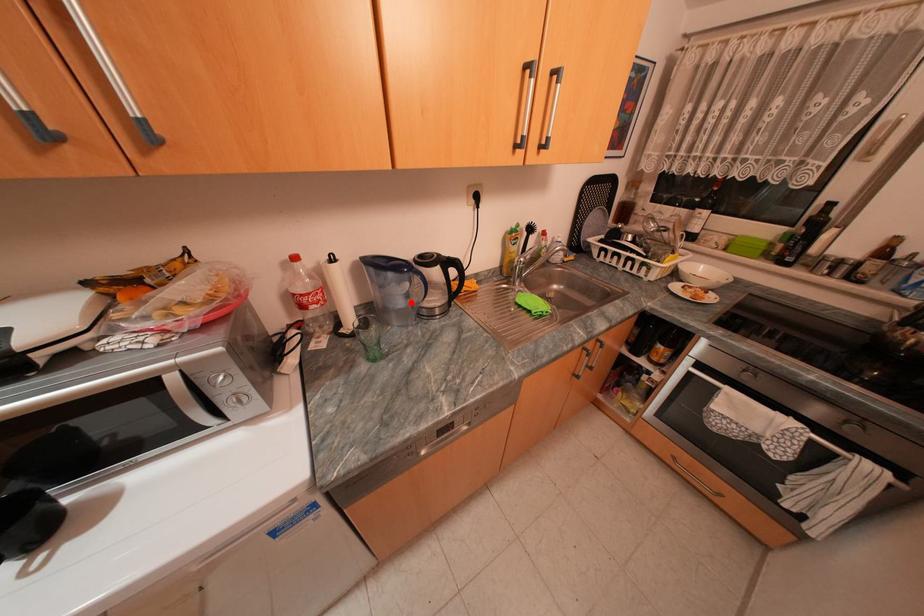
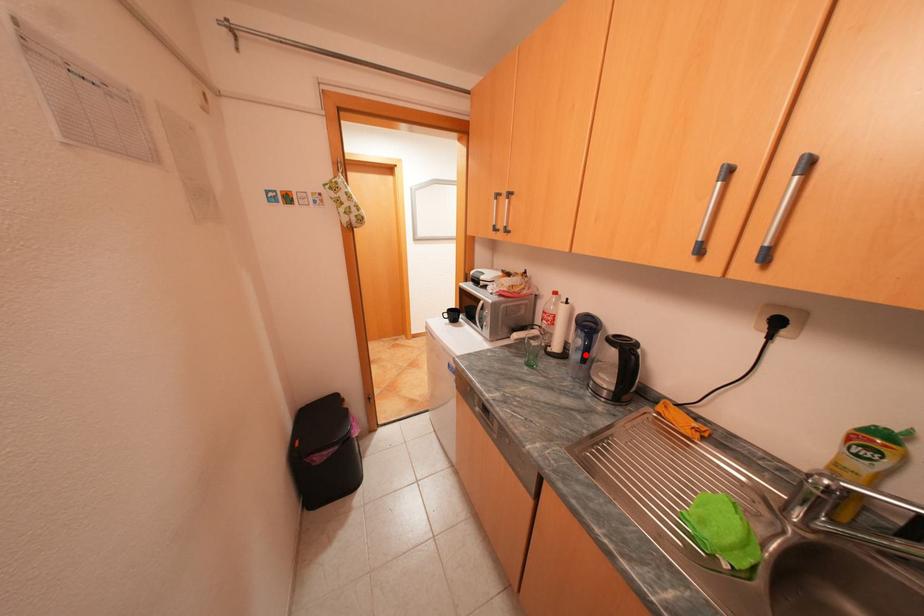
I am providing you with two images of the same scene from different viewpoints. A red point is marked on the first image and another point is marked on the second image. Are the points marked in image1 and image2 representing the same 3D position?

Yes